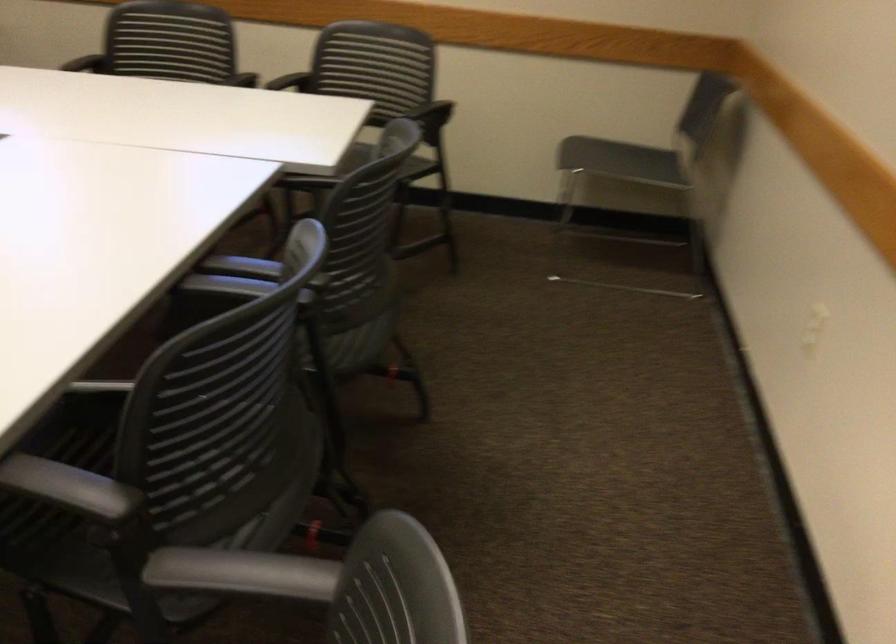
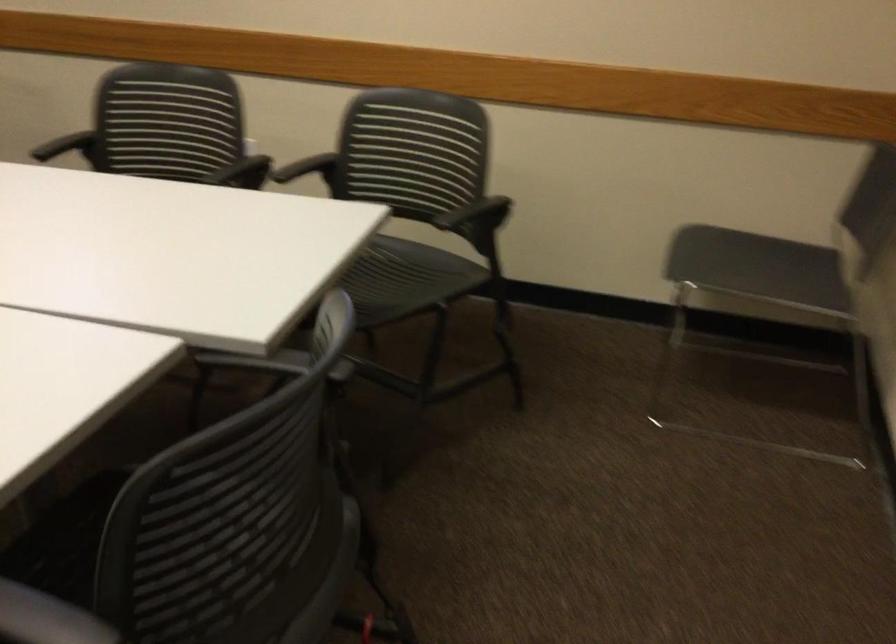
Question: Based on the continuous images, in which direction is the camera rotating? Reply with the corresponding letter.

Choices:
 (A) Left
 (B) Right
 (C) Up
 (D) Down

Answer: (A)